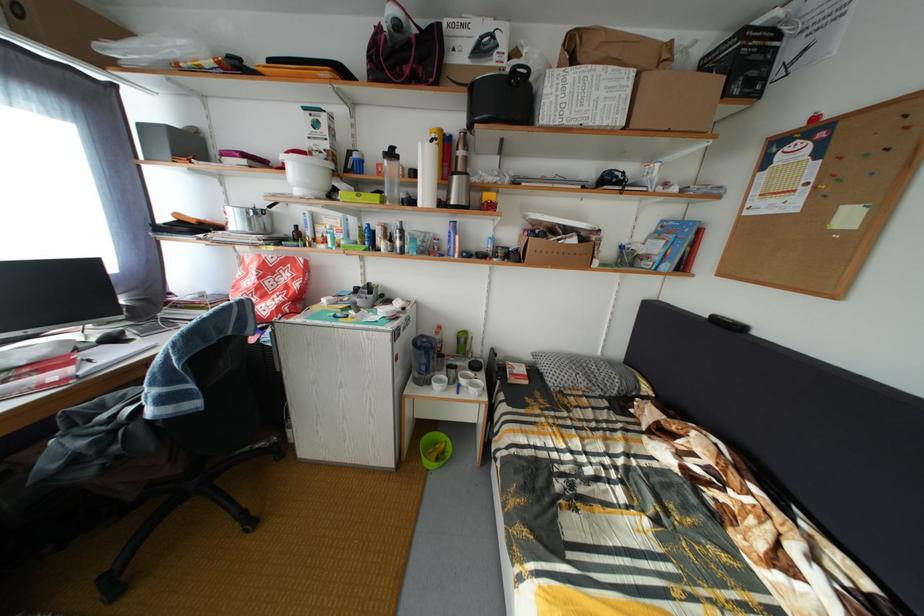
Find where to lift the blue water kettle. Please return your answer as a coordinate pair (x, y).

(422, 359)